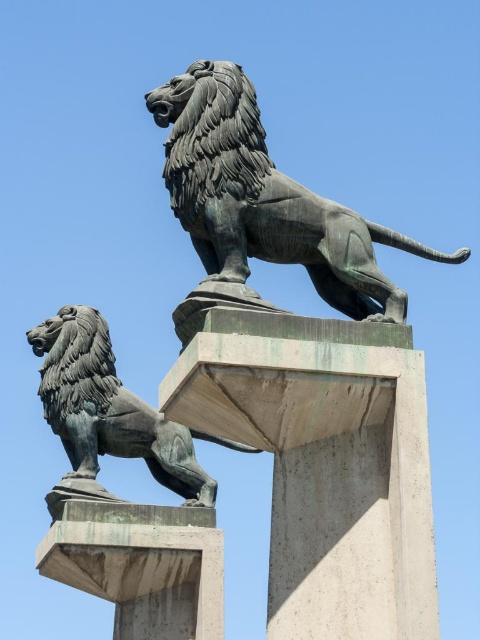
You are standing in front of the two bronze lion statues. There is a point marked at coordinates [325,464]. What does this point represent?

The point at coordinates [325,464] corresponds to the sanded concrete pillar at center.

You are a maintenance worker needing to reach the concrete at center from the bronze lion at lower left. Given that your ladder is 5 meters long, will it be sufficient to bridge the gap?

The distance between the concrete at center and bronze lion at lower left is 5.16 meters. Since the ladder is only 5 meters long, it is 16 centimeters short, so the ladder will not be sufficient to bridge the gap.

You are an art installer who needs to transport the bronze lion at upper center and the concrete at center to a new location. The truck you have can only carry items that are smaller than 3 meters in height. Can both items be transported together without exceeding the truck height limit?

The bronze lion at upper center is larger in size than concrete at center. However, since the exact heights are not provided, we cannot determine if both items can be transported together without exceeding the truck height limit of 3 meters. Additional measurements are needed.